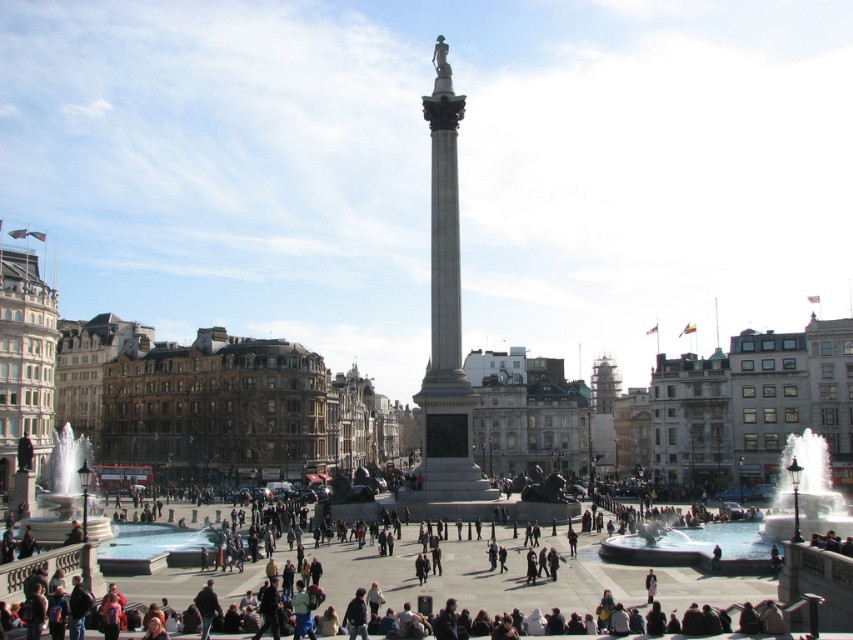
Which is above, shiny metallic fountain at lower right or white marble fountain at lower left?

white marble fountain at lower left

Where is `shiny metallic fountain at lower right`? shiny metallic fountain at lower right is located at coordinates (749, 522).

Locate an element on the screen. shiny metallic fountain at lower right is located at coordinates (749, 522).

Between point (837, 525) and point (62, 492), which one is positioned in front?

Positioned in front is point (837, 525).

What are the coordinates of `white frothy water at lower right` in the screenshot? It's located at (805, 492).

Who is taller, smooth stone column at center or white frothy water at lower right?

With more height is smooth stone column at center.

Can you confirm if smooth stone column at center is wider than white frothy water at lower right?

No, smooth stone column at center is not wider than white frothy water at lower right.

Between point (427, 472) and point (779, 483), which one is positioned behind?

The point (779, 483) is behind.

At what (x,y) coordinates should I click in order to perform the action: click on smooth stone column at center. Please return your answer as a coordinate pair (x, y). Looking at the image, I should click on (445, 314).